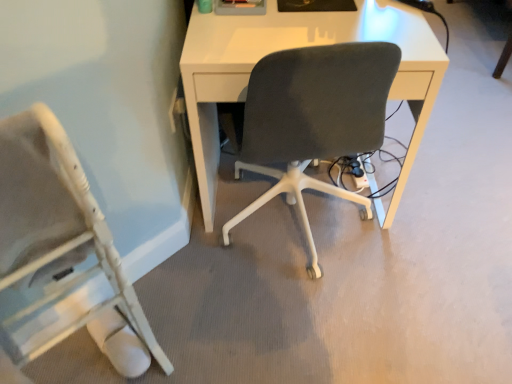
Question: Considering the relative sizes of white wood chair at lower left and white matte desk at center in the image provided, is white wood chair at lower left smaller than white matte desk at center?

Choices:
 (A) no
 (B) yes

Answer: (B)

Question: Could you tell me if white wood chair at lower left is turned towards white matte desk at center?

Choices:
 (A) yes
 (B) no

Answer: (B)

Question: Can you confirm if white wood chair at lower left is bigger than white matte desk at center?

Choices:
 (A) no
 (B) yes

Answer: (A)

Question: Is white wood chair at lower left positioned in front of white matte desk at center?

Choices:
 (A) no
 (B) yes

Answer: (B)

Question: From the image's perspective, is white wood chair at lower left beneath white matte desk at center?

Choices:
 (A) yes
 (B) no

Answer: (A)

Question: Is white matte desk at center located within white wood chair at lower left?

Choices:
 (A) no
 (B) yes

Answer: (A)

Question: Is white wood chair at lower left at the back of white matte desk at center?

Choices:
 (A) yes
 (B) no

Answer: (B)

Question: Is white wood chair at lower left completely or partially inside white matte desk at center?

Choices:
 (A) no
 (B) yes

Answer: (A)

Question: Is white matte desk at center to the left of white wood chair at lower left from the viewer's perspective?

Choices:
 (A) yes
 (B) no

Answer: (B)

Question: Is the depth of white matte desk at center greater than that of white wood chair at lower left?

Choices:
 (A) yes
 (B) no

Answer: (A)

Question: Is white matte desk at center positioned far away from white wood chair at lower left?

Choices:
 (A) yes
 (B) no

Answer: (B)

Question: Is white matte desk at center placed right next to white wood chair at lower left?

Choices:
 (A) no
 (B) yes

Answer: (A)

Question: From a real-world perspective, is white matte desk at center positioned above or below white wood chair at lower left?

Choices:
 (A) below
 (B) above

Answer: (A)